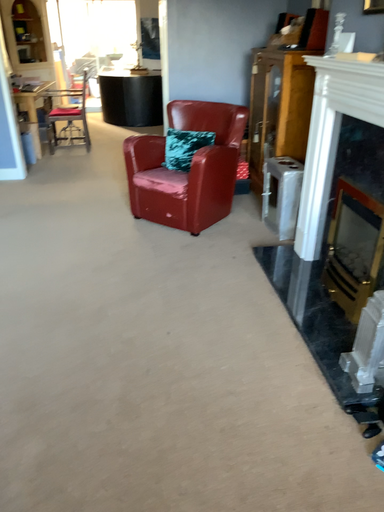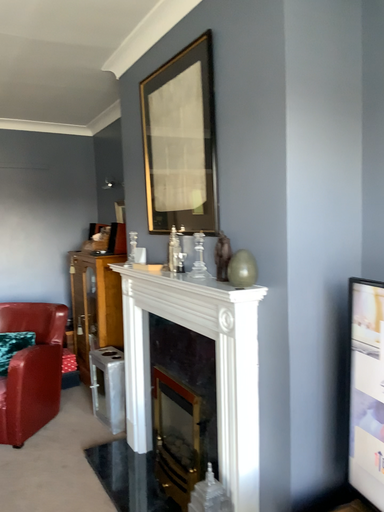
Question: How did the camera likely rotate when shooting the video?

Choices:
 (A) rotated upward
 (B) rotated downward

Answer: (A)